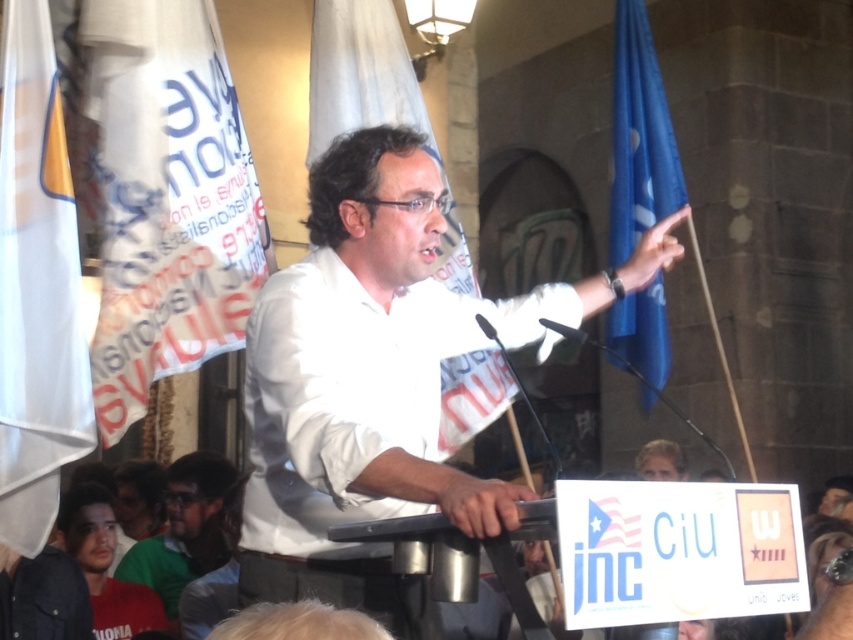
You are attending a political rally and notice two items in the background. The white fabric banner at upper left and the blue fabric flag at right. Which one is taller?

The white fabric banner at upper left is taller than the blue fabric flag at right.

You are organizing a photo shoot and need to ensure that the white matte shirt at center and the green matte shirt at lower left are visible in the frame. Based on their sizes in the image, which shirt should you focus on to ensure it takes up more of the frame?

The green matte shirt at lower left should be focused on because it occupies more space in the frame than the white matte shirt at center according to the description.